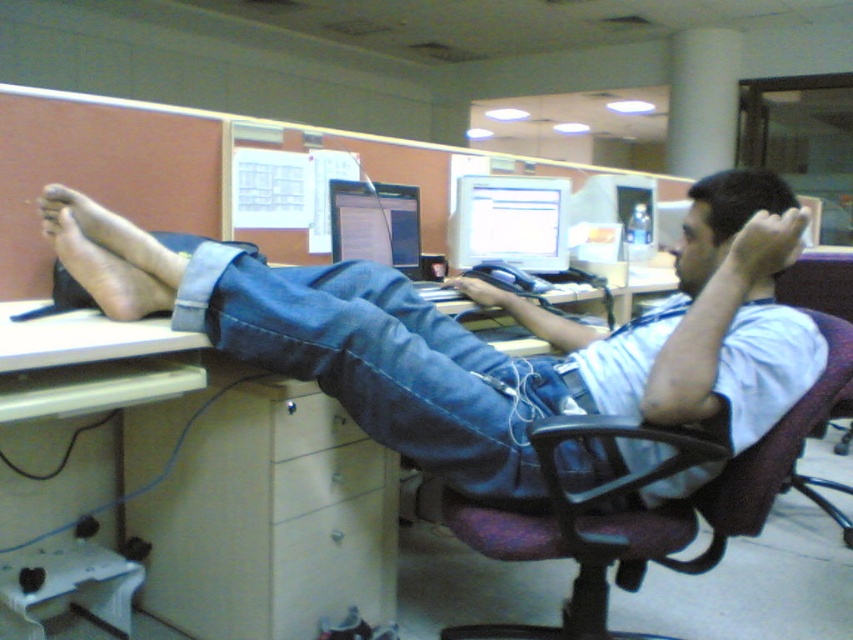
What are the coordinates of the denim at center in the image?

The coordinates of the denim at center are at point (384,364).

From the picture: You are standing in front of the desk and want to place a small object on the desk. You have two points to choose from, point A at coordinates point (540,508) and point B at coordinates point (476,209). Which point is closer to you?

Point A at coordinates point (540,508) is closer to the viewer than point B at coordinates point (476,209).